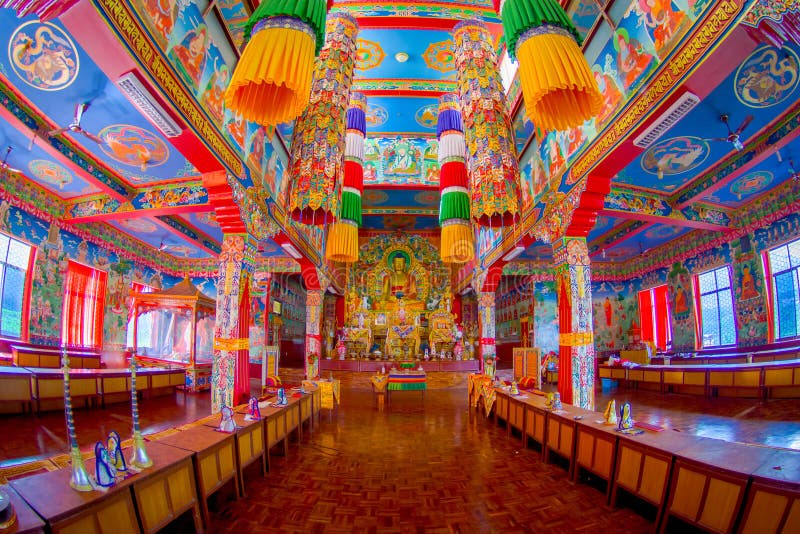
I want to click on ceiling beams, so click(x=160, y=202), click(x=100, y=177), click(x=657, y=207), click(x=709, y=182).